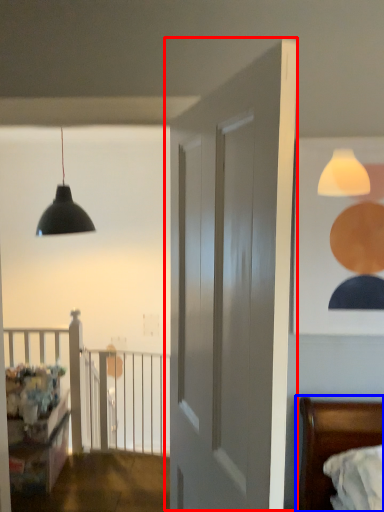
Question: Among these objects, which one is farthest to the camera, door (highlighted by a red box) or bed (highlighted by a blue box)?

Choices:
 (A) door
 (B) bed

Answer: (B)